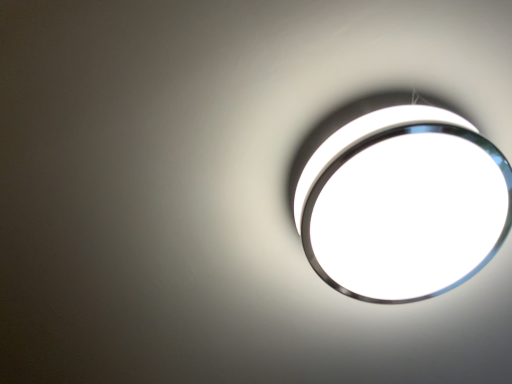
What do you see at coordinates (400, 198) in the screenshot?
I see `satin silver ring at upper center` at bounding box center [400, 198].

Measure the distance between satin silver ring at upper center and camera.

A distance of 51.14 centimeters exists between satin silver ring at upper center and camera.

Where is `satin silver ring at upper center`? satin silver ring at upper center is located at coordinates (400, 198).

The height and width of the screenshot is (384, 512). I want to click on satin silver ring at upper center, so click(400, 198).